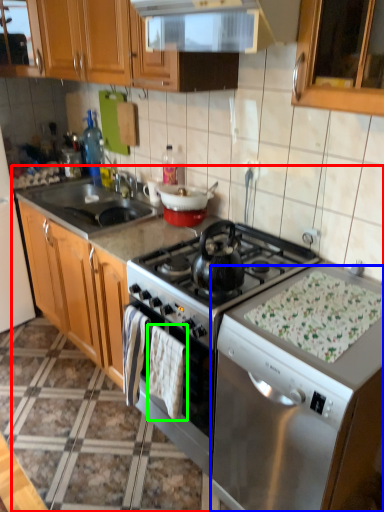
Question: Estimate the real-world distances between objects in this image. Which object is closer to countertop (highlighted by a red box), dish washer (highlighted by a blue box) or blanket (highlighted by a green box)?

Choices:
 (A) dish washer
 (B) blanket

Answer: (B)